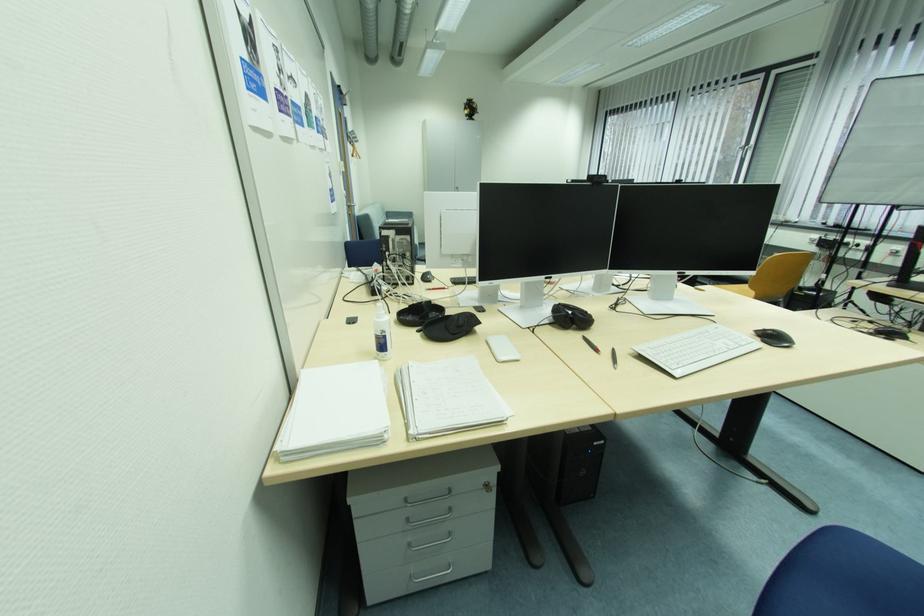
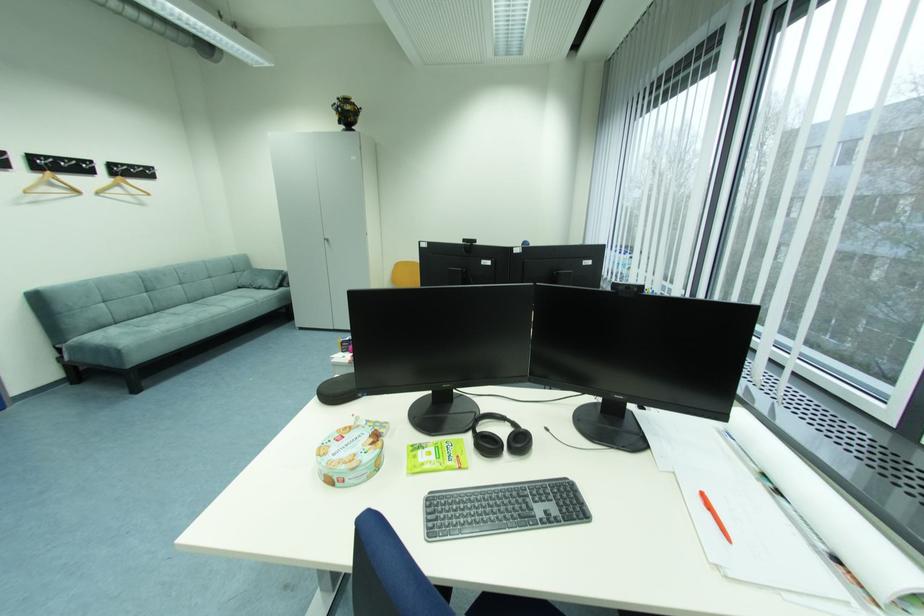
In the second image, find the point that corresponds to (472,103) in the first image.

(344, 103)